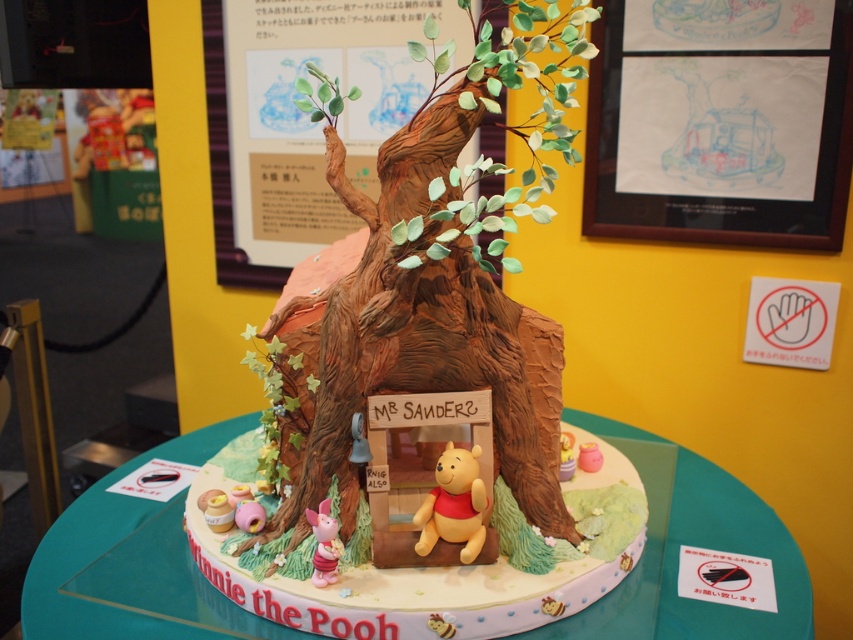
You are a guest at a birthday party and want to place a small candle on the cake. The candle is 2 inches tall. The cake has a matte brown treehouse at center and a matte brown bear at center. Considering the height of the candle and the positions of the two objects, where would you place the candle to ensure it doesn

The candle should be placed either on the matte brown treehouse at center or the matte brown bear at center since both are 17.47 inches apart, allowing enough space for the candle to stand upright without obstruction.

You are a photographer positioned at the origin point of the coordinate system. You want to capture the matte brown treehouse at center in your shot. Based on its coordinates, is it located to the left or right of the center point of the image?

The matte brown treehouse at center is located at coordinates point (428, 387), which is to the right of the center point of the image.

You are a guest at a birthday party where this cake is displayed. You notice the pink glossy piglet at lower left and the matte brown bear at center. Which of these two objects is taller?

The pink glossy piglet at lower left is taller than the matte brown bear at center according to the description.